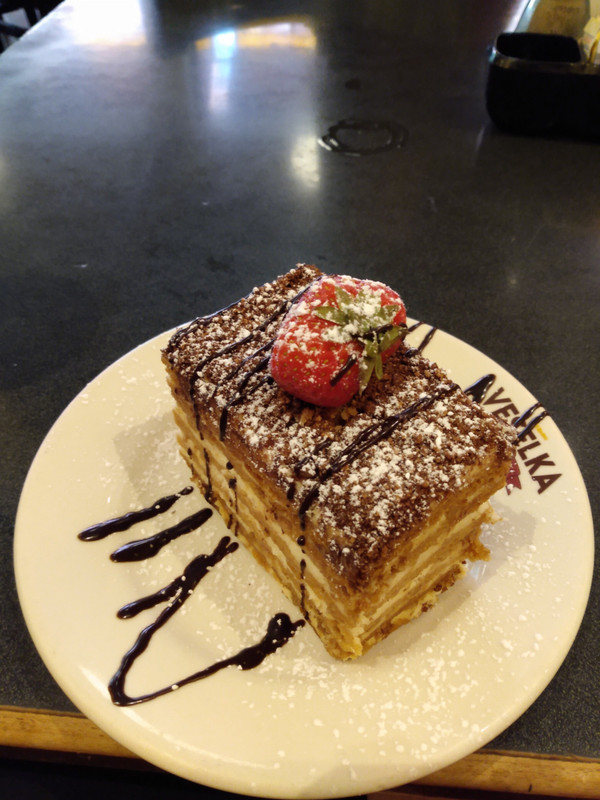
The height and width of the screenshot is (800, 600). What are the coordinates of `plate` in the screenshot? It's located at (266, 744).